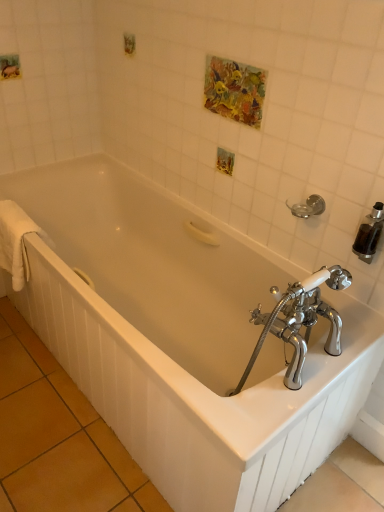
Question: Is white soft towel at left positioned before silver metallic towel bar at upper right?

Choices:
 (A) no
 (B) yes

Answer: (A)

Question: Can you confirm if white soft towel at left is bigger than silver metallic towel bar at upper right?

Choices:
 (A) yes
 (B) no

Answer: (A)

Question: Is white soft towel at left to the left of silver metallic towel bar at upper right from the viewer's perspective?

Choices:
 (A) no
 (B) yes

Answer: (B)

Question: Is white soft towel at left outside of silver metallic towel bar at upper right?

Choices:
 (A) no
 (B) yes

Answer: (B)

Question: From a real-world perspective, is white soft towel at left located beneath silver metallic towel bar at upper right?

Choices:
 (A) no
 (B) yes

Answer: (B)

Question: In terms of width, does silver metallic towel bar at upper right look wider or thinner when compared to white soft towel at left?

Choices:
 (A) wide
 (B) thin

Answer: (B)

Question: From a real-world perspective, is silver metallic towel bar at upper right physically located above or below white soft towel at left?

Choices:
 (A) below
 (B) above

Answer: (B)

Question: Is silver metallic towel bar at upper right to the left or to the right of white soft towel at left in the image?

Choices:
 (A) left
 (B) right

Answer: (B)

Question: From their relative heights in the image, would you say silver metallic towel bar at upper right is taller or shorter than white soft towel at left?

Choices:
 (A) short
 (B) tall

Answer: (A)

Question: From a real-world perspective, is white glossy bathtub at center physically located above or below silver metallic towel bar at upper right?

Choices:
 (A) below
 (B) above

Answer: (A)

Question: Is point (190, 238) positioned closer to the camera than point (309, 205)?

Choices:
 (A) closer
 (B) farther

Answer: (B)

Question: Is white glossy bathtub at center wider or thinner than silver metallic towel bar at upper right?

Choices:
 (A) thin
 (B) wide

Answer: (B)

Question: Choose the correct answer: Is white glossy bathtub at center inside silver metallic towel bar at upper right or outside it?

Choices:
 (A) inside
 (B) outside

Answer: (B)

Question: In the image, is silver metallic towel bar at upper right positioned in front of or behind white glossy bathtub at center?

Choices:
 (A) front
 (B) behind

Answer: (B)

Question: In terms of size, does silver metallic towel bar at upper right appear bigger or smaller than white glossy bathtub at center?

Choices:
 (A) small
 (B) big

Answer: (A)